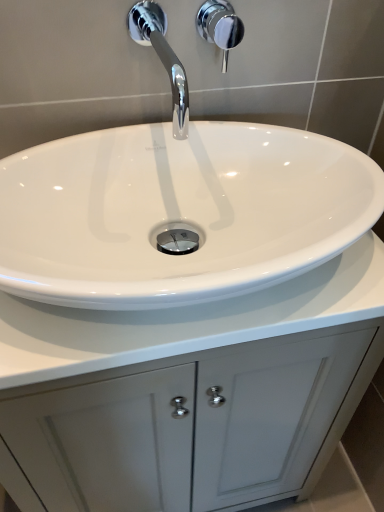
Measure the distance between point (166, 330) and camera.

A distance of 20.24 inches exists between point (166, 330) and camera.

I want to click on white glossy sink at center, so click(x=289, y=66).

Describe the element at coordinates (162, 58) in the screenshot. I see `chrome/metallic faucet at upper center` at that location.

The width and height of the screenshot is (384, 512). I want to click on chrome metallic shower handle at upper center, so click(x=220, y=26).

From the image's perspective, is chrome metallic shower handle at upper center positioned above or below white glossy sink at center?

Based on their image positions, chrome metallic shower handle at upper center is located above white glossy sink at center.

From the picture: Is chrome metallic shower handle at upper center wider than white glossy sink at center?

No.

Considering the relative positions of chrome metallic shower handle at upper center and white glossy sink at center in the image provided, is chrome metallic shower handle at upper center to the left or to the right of white glossy sink at center?

In the image, chrome metallic shower handle at upper center appears on the right side of white glossy sink at center.

Can we say chrome metallic shower handle at upper center lies outside white glossy sink at center?

Absolutely, chrome metallic shower handle at upper center is external to white glossy sink at center.

In the scene shown: Which is more to the left, white glossy sink at center or white glossy cabinet at center?

Positioned to the left is white glossy cabinet at center.

Looking at this image, is white glossy sink at center touching white glossy cabinet at center?

They are not placed beside each other.

From the image's perspective, would you say white glossy sink at center is positioned over white glossy cabinet at center?

Yes.

In the scene shown: Does white glossy cabinet at center have a lesser height compared to chrome/metallic faucet at upper center?

No.

Looking at this image, from the image's perspective, between white glossy cabinet at center and chrome/metallic faucet at upper center, who is located below?

white glossy cabinet at center.

Identify the location of tap on the left of white glossy cabinet at center. (162, 58).

From the image's perspective, between chrome metallic shower handle at upper center and chrome/metallic faucet at upper center, which one is located above?

chrome metallic shower handle at upper center, from the image's perspective.

Is chrome/metallic faucet at upper center inside chrome metallic shower handle at upper center?

That's incorrect, chrome/metallic faucet at upper center is not inside chrome metallic shower handle at upper center.

From a real-world perspective, is chrome metallic shower handle at upper center physically above chrome/metallic faucet at upper center?

Incorrect, from a real-world perspective, chrome metallic shower handle at upper center is lower than chrome/metallic faucet at upper center.

From a real-world perspective, is white glossy cabinet at center under white glossy sink at center?

Yes.

In the scene shown: Is white glossy cabinet at center behind white glossy sink at center?

Yes, white glossy cabinet at center is further from the camera.

Would you say white glossy cabinet at center is inside or outside white glossy sink at center?

white glossy cabinet at center cannot be found inside white glossy sink at center.

In terms of width, does white glossy sink at center look wider or thinner when compared to chrome metallic shower handle at upper center?

white glossy sink at center is wider than chrome metallic shower handle at upper center.

From the picture: Is chrome metallic shower handle at upper center inside white glossy sink at center?

Actually, chrome metallic shower handle at upper center is outside white glossy sink at center.

Are white glossy sink at center and chrome metallic shower handle at upper center located far from each other?

They are positioned close to each other.

Between point (10, 309) and point (199, 30), which one is positioned in front?

The point (10, 309) is closer.

From the image's perspective, is white glossy cabinet at center above or below chrome metallic shower handle at upper center?

white glossy cabinet at center is situated lower than chrome metallic shower handle at upper center in the image.

Which of these two, white glossy cabinet at center or chrome metallic shower handle at upper center, is thinner?

chrome metallic shower handle at upper center.

Does white glossy cabinet at center appear on the right side of chrome metallic shower handle at upper center?

No.

The image size is (384, 512). I want to click on shower located behind the white glossy sink at center, so click(220, 26).

The width and height of the screenshot is (384, 512). Identify the location of sink above the white glossy cabinet at center (from a real-world perspective). (289, 66).

Estimate the real-world distances between objects in this image. Which object is closer to white glossy sink at center, chrome metallic shower handle at upper center or chrome/metallic faucet at upper center?

chrome/metallic faucet at upper center.

Looking at this image, from the image, which object appears to be farther from chrome/metallic faucet at upper center, white glossy cabinet at center or chrome metallic shower handle at upper center?

white glossy cabinet at center is further to chrome/metallic faucet at upper center.

Which object lies further to the anchor point chrome/metallic faucet at upper center, white glossy sink at center or white glossy cabinet at center?

Among the two, white glossy cabinet at center is located further to chrome/metallic faucet at upper center.

Based on their spatial positions, is chrome/metallic faucet at upper center or chrome metallic shower handle at upper center closer to white glossy cabinet at center?

chrome/metallic faucet at upper center is positioned closer to the anchor white glossy cabinet at center.

From the image, which object appears to be nearer to chrome metallic shower handle at upper center, white glossy sink at center or white glossy cabinet at center?

white glossy sink at center lies closer to chrome metallic shower handle at upper center than the other object.

Which object lies nearer to the anchor point chrome metallic shower handle at upper center, chrome/metallic faucet at upper center or white glossy sink at center?

Based on the image, chrome/metallic faucet at upper center appears to be nearer to chrome metallic shower handle at upper center.

Looking at the image, which one is located further to white glossy cabinet at center, white glossy sink at center or chrome/metallic faucet at upper center?

chrome/metallic faucet at upper center.

Based on the photo, when comparing their distances from chrome/metallic faucet at upper center, does white glossy sink at center or chrome metallic shower handle at upper center seem further?

white glossy sink at center is further to chrome/metallic faucet at upper center.

This screenshot has width=384, height=512. What are the coordinates of `tap between chrome metallic shower handle at upper center and white glossy sink at center vertically` in the screenshot? It's located at (162, 58).

Find the location of a particular element. sink that lies between chrome metallic shower handle at upper center and white glossy cabinet at center from top to bottom is located at coordinates (289, 66).

Find the location of a particular element. tap that lies between chrome metallic shower handle at upper center and white glossy cabinet at center from top to bottom is located at coordinates (162, 58).

Where is `sink between chrome/metallic faucet at upper center and white glossy cabinet at center in the vertical direction`? sink between chrome/metallic faucet at upper center and white glossy cabinet at center in the vertical direction is located at coordinates (289, 66).